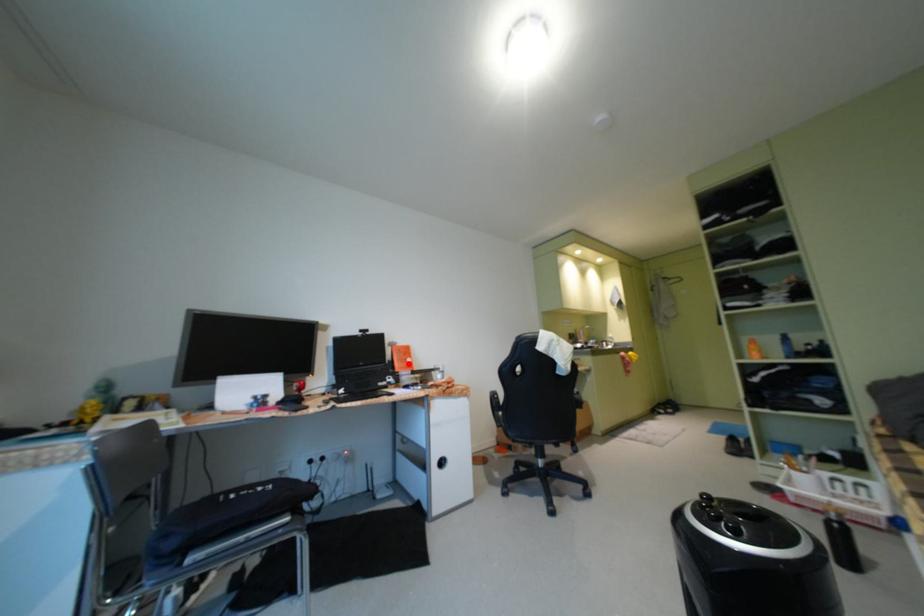
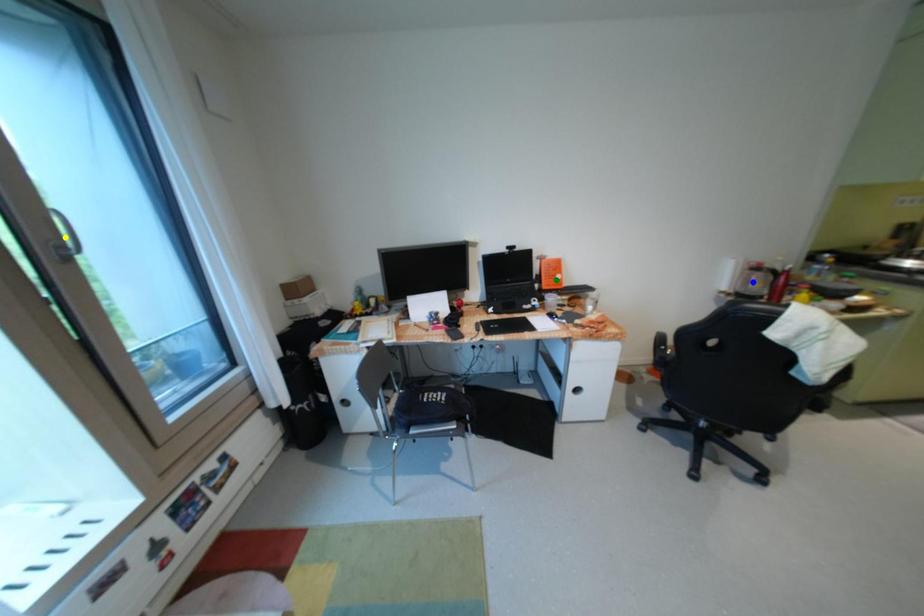
Question: I am providing you with two images of the same scene from different viewpoints. A red point is marked on the first image. You are given multiple points on the second image. Which spot in image 2 lines up with the point in image 1?

Choices:
 (A) yellow point
 (B) green point
 (C) blue point

Answer: (B)